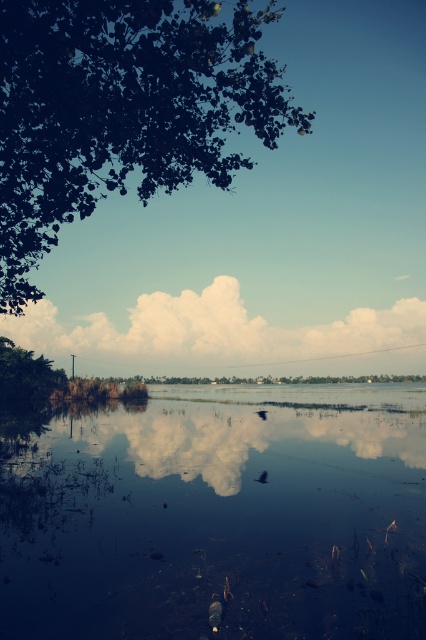
Question: Can you confirm if green leafy tree at upper left is wider than white fluffy cloud at center?

Choices:
 (A) yes
 (B) no

Answer: (B)

Question: Does glossy reflective water at center appear on the right side of white fluffy cloud at center?

Choices:
 (A) yes
 (B) no

Answer: (B)

Question: Which of these objects is positioned farthest from the glossy reflective water at center?

Choices:
 (A) white fluffy cloud at center
 (B) green leafy tree at upper left

Answer: (A)

Question: Observing the image, what is the correct spatial positioning of glossy reflective water at center in reference to green leafy tree at upper left?

Choices:
 (A) below
 (B) above

Answer: (A)

Question: Which point is closer to the camera taking this photo?

Choices:
 (A) (100, 346)
 (B) (163, 29)
 (C) (144, 484)

Answer: (B)

Question: Estimate the real-world distances between objects in this image. Which object is farther from the green leafy tree at upper left?

Choices:
 (A) white fluffy cloud at center
 (B) glossy reflective water at center

Answer: (A)